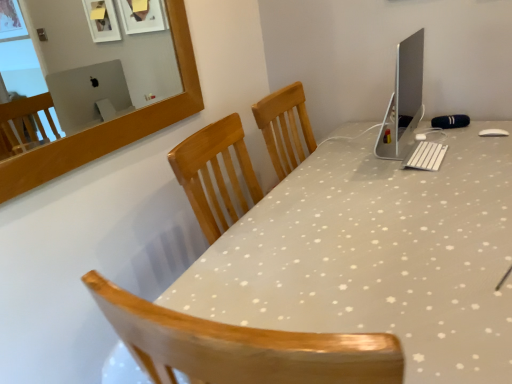
You are a GUI agent. You are given a task and a screenshot of the screen. Output one action in this format:
    pyautogui.click(x=<x>, y=<y>)
    Task: Click on the empty space that is ontop of white plastic keyboard at center (from a real-world perspective)
    
    Given the screenshot: What is the action you would take?
    pyautogui.click(x=428, y=149)